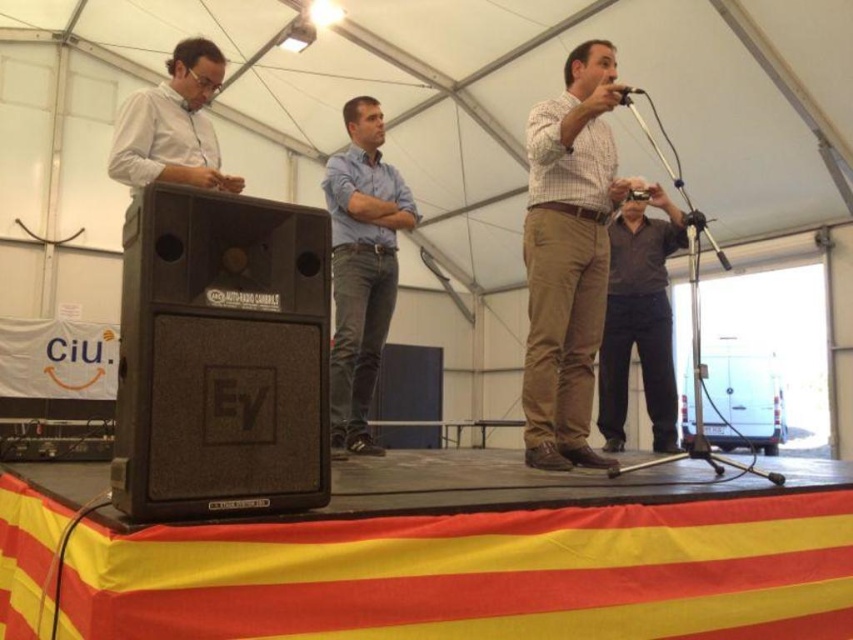
Question: Which point is farther to the camera?

Choices:
 (A) black matte speaker at left
 (B) plaid cotton shirt at center
 (C) metallic silver microphone at upper center

Answer: (B)

Question: Does dark brown shirt at center appear under metallic silver microphone at upper center?

Choices:
 (A) no
 (B) yes

Answer: (B)

Question: Can you confirm if black matte speaker at left is positioned above blue denim jeans at center?

Choices:
 (A) no
 (B) yes

Answer: (A)

Question: Which point appears closest to the camera in this image?

Choices:
 (A) (634, 332)
 (B) (358, 369)
 (C) (206, 365)

Answer: (C)

Question: Can you confirm if plaid cotton shirt at center is positioned above metallic silver microphone at upper center?

Choices:
 (A) yes
 (B) no

Answer: (B)

Question: Which of the following is the farthest from the observer?

Choices:
 (A) blue denim jeans at center
 (B) dark brown shirt at center
 (C) metallic silver microphone at upper center

Answer: (B)